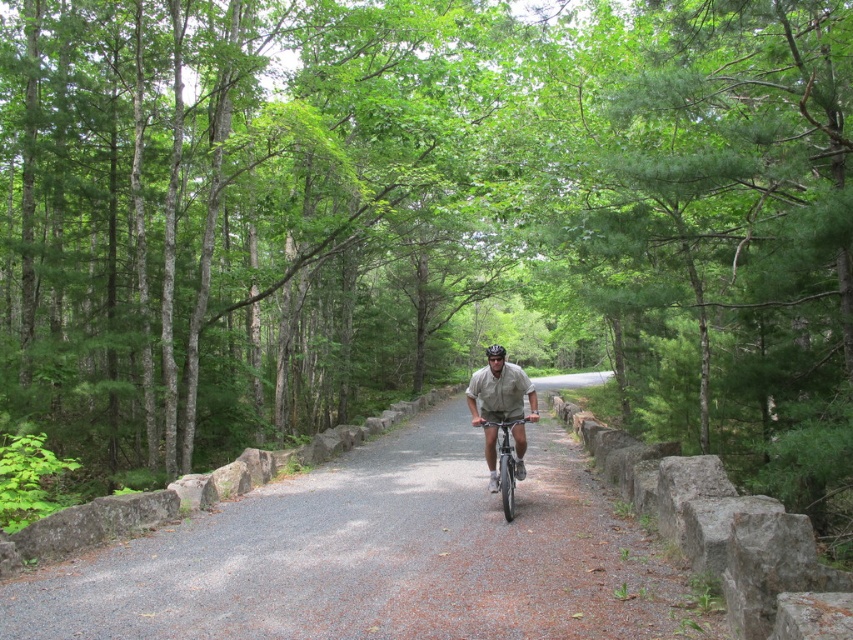
Question: Among these objects, which one is nearest to the camera?

Choices:
 (A) khaki fabric shirt at center
 (B) black matte bicycle helmet at center
 (C) gray gravel path at center
 (D) silver metallic bicycle at center

Answer: (C)

Question: Which is farther from the black matte bicycle helmet at center?

Choices:
 (A) silver metallic bicycle at center
 (B) gray gravel path at center
 (C) khaki fabric shirt at center

Answer: (C)

Question: Is silver metallic bicycle at center positioned at the back of black matte bicycle helmet at center?

Choices:
 (A) no
 (B) yes

Answer: (A)

Question: Can you confirm if gray gravel path at center is wider than khaki fabric shirt at center?

Choices:
 (A) no
 (B) yes

Answer: (B)

Question: Which object is positioned farthest from the khaki fabric shirt at center?

Choices:
 (A) gray gravel path at center
 (B) silver metallic bicycle at center

Answer: (A)

Question: Is gray gravel path at center thinner than silver metallic bicycle at center?

Choices:
 (A) no
 (B) yes

Answer: (A)